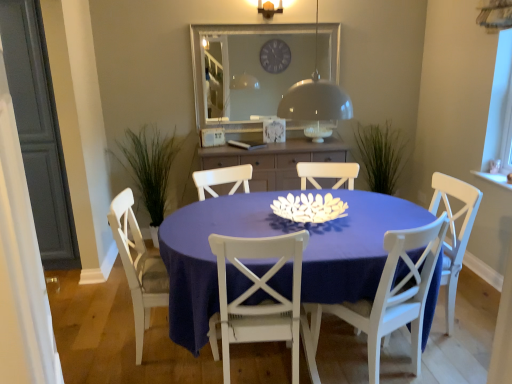
What do you see at coordinates (245, 72) in the screenshot? The image size is (512, 384). I see `clear glass mirror at upper center` at bounding box center [245, 72].

Locate an element on the screen. white wood chair at center, which appears as the 4th chair when viewed from the left is located at coordinates (454, 232).

Describe the element at coordinates (316, 103) in the screenshot. This screenshot has height=384, width=512. I see `white glossy dome at upper center` at that location.

This screenshot has width=512, height=384. What do you see at coordinates (309, 208) in the screenshot?
I see `white matte flower at center` at bounding box center [309, 208].

Describe the element at coordinates (138, 266) in the screenshot. I see `white wood chair at center, the 4th chair viewed from the right` at that location.

Identify the location of white painted wood chair at center, the 3th chair in the right-to-left sequence. (263, 290).

The image size is (512, 384). In order to click on chair behind the white matte flower at center in this screenshot , I will do `click(454, 232)`.

Considering the relative sizes of white matte flower at center and white wood chair at center, which is the first chair in right-to-left order, in the image provided, is white matte flower at center thinner than white wood chair at center, which is the first chair in right-to-left order,?

Correct, the width of white matte flower at center is less than that of white wood chair at center, which is the first chair in right-to-left order.

Consider the image. Is white matte flower at center shorter than white wood chair at center, which appears as the 4th chair when viewed from the left?

Yes, white matte flower at center is shorter than white wood chair at center, which appears as the 4th chair when viewed from the left.

Are green grass at left and white wood chair at center, placed as the 3th chair when sorted from left to right, beside each other?

No.

From a real-world perspective, is green grass at left positioned under white wood chair at center, placed as the 3th chair when sorted from left to right, based on gravity?

No.

In the scene shown: Relative to white wood chair at center, placed as the 3th chair when sorted from left to right, is green grass at left in front or behind?

green grass at left is positioned farther from the viewer than white wood chair at center, placed as the 3th chair when sorted from left to right.

Which is behind, point (129, 164) or point (304, 343)?

The point (129, 164) is more distant.

Can you tell me how much white glossy dome at upper center and white wood chair at center, placed as the 3th chair when sorted from left to right, differ in facing direction?

The facing directions of white glossy dome at upper center and white wood chair at center, placed as the 3th chair when sorted from left to right, are 69 degrees apart.

How much distance is there between white glossy dome at upper center and white wood chair at center, placed as the 3th chair when sorted from left to right?

The distance of white glossy dome at upper center from white wood chair at center, placed as the 3th chair when sorted from left to right, is 89.50 centimeters.

From the image's perspective, count 3rd chairs downward from the white glossy dome at upper center and point to it. Please provide its 2D coordinates.

[(385, 299)]

Could you tell me if white glossy dome at upper center is turned towards white wood chair at center, the 2th chair when ordered from right to left?

No, white glossy dome at upper center is not turned towards white wood chair at center, the 2th chair when ordered from right to left.

Considering the points (233, 162) and (339, 106), which point is in front, point (233, 162) or point (339, 106)?

Point (339, 106)

Which object is more forward, matte wood cabinet at center or white glossy dome at upper center?

white glossy dome at upper center.

Looking at this image, from a real-world perspective, does matte wood cabinet at center stand above white glossy dome at upper center?

No, from a real-world perspective, matte wood cabinet at center is not above white glossy dome at upper center.

Is matte wood cabinet at center wider or thinner than white glossy dome at upper center?

Clearly, matte wood cabinet at center has more width compared to white glossy dome at upper center.

Choose the correct answer: Is white wood chair at center, which is the first chair in right-to-left order, inside matte blue table at center or outside it?

white wood chair at center, which is the first chair in right-to-left order, is spatially positioned inside matte blue table at center.

Is white wood chair at center, which appears as the 4th chair when viewed from the left, taller or shorter than matte blue table at center?

Considering their sizes, white wood chair at center, which appears as the 4th chair when viewed from the left, has more height than matte blue table at center.

Looking at this image, is white wood chair at center, which is the first chair in right-to-left order, aimed at matte blue table at center?

Yes, white wood chair at center, which is the first chair in right-to-left order, is turned towards matte blue table at center.

Considering the positions of objects white wood chair at center, which appears as the 4th chair when viewed from the left, and matte blue table at center in the image provided, who is more to the right, white wood chair at center, which appears as the 4th chair when viewed from the left, or matte blue table at center?

From the viewer's perspective, white wood chair at center, which appears as the 4th chair when viewed from the left, appears more on the right side.

Is white wood chair at center, placed as the 3th chair when sorted from left to right, completely or partially outside of white wood chair at center, the 1th chair when ordered from left to right?

Indeed, white wood chair at center, placed as the 3th chair when sorted from left to right, is completely outside white wood chair at center, the 1th chair when ordered from left to right.

From the image's perspective, is white wood chair at center, placed as the 3th chair when sorted from left to right, above or below white wood chair at center, the 4th chair viewed from the right?

From the image's perspective, white wood chair at center, placed as the 3th chair when sorted from left to right, appears below white wood chair at center, the 4th chair viewed from the right.

Could you measure the distance between white wood chair at center, placed as the 3th chair when sorted from left to right, and white wood chair at center, the 1th chair when ordered from left to right?

white wood chair at center, placed as the 3th chair when sorted from left to right, and white wood chair at center, the 1th chair when ordered from left to right, are 3.67 feet apart from each other.

There is a white wood chair at center, the 2th chair when ordered from right to left. Identify the location of the 1st chair above it (from the image's perspective). The image size is (512, 384). (138, 266).

Looking at their sizes, would you say white wood chair at center, the 2th chair when ordered from right to left, is wider or thinner than matte blue table at center?

Clearly, white wood chair at center, the 2th chair when ordered from right to left, has less width compared to matte blue table at center.

Is the surface of white wood chair at center, placed as the 3th chair when sorted from left to right, in direct contact with matte blue table at center?

There is a gap between white wood chair at center, placed as the 3th chair when sorted from left to right, and matte blue table at center.

How far apart are white wood chair at center, placed as the 3th chair when sorted from left to right, and matte blue table at center?

A: white wood chair at center, placed as the 3th chair when sorted from left to right, and matte blue table at center are 14.10 inches apart.

In the scene shown: Is white wood chair at center, placed as the 3th chair when sorted from left to right, to the left of matte blue table at center from the viewer's perspective?

No, white wood chair at center, placed as the 3th chair when sorted from left to right, is not to the left of matte blue table at center.

There is a white matte flower at center. In order to click on the 1st chair below it (from the image's perspective) in this screenshot , I will do `click(454, 232)`.

At what (x,y) coordinates should I click in order to perform the action: click on plant located above the white wood chair at center, the 2th chair when ordered from right to left (from a real-world perspective). Please return your answer as a coordinate pair (x, y). This screenshot has height=384, width=512. Looking at the image, I should click on (149, 166).

Based on their spatial positions, is white matte flower at center or matte blue table at center further from matte wood cabinet at center?

The object further to matte wood cabinet at center is matte blue table at center.

From the image, which object appears to be nearer to matte blue table at center, white painted wood chair at center, placed as the second chair when sorted from left to right, or matte wood cabinet at center?

Based on the image, white painted wood chair at center, placed as the second chair when sorted from left to right, appears to be nearer to matte blue table at center.

Looking at the image, which one is located closer to white wood chair at center, placed as the 3th chair when sorted from left to right, white matte flower at center or white glossy dome at upper center?

white matte flower at center lies closer to white wood chair at center, placed as the 3th chair when sorted from left to right, than the other object.

When comparing their distances from white wood chair at center, the 1th chair when ordered from left to right, does white painted wood chair at center, the 3th chair in the right-to-left sequence, or green grass at left seem closer?

white painted wood chair at center, the 3th chair in the right-to-left sequence.

Based on their spatial positions, is matte blue table at center or white wood chair at center, placed as the 3th chair when sorted from left to right, closer to clear glass mirror at upper center?

matte blue table at center is positioned closer to the anchor clear glass mirror at upper center.

Based on their spatial positions, is green grass at left or matte wood cabinet at center further from clear glass mirror at upper center?

Based on the image, green grass at left appears to be further to clear glass mirror at upper center.

Based on their spatial positions, is white painted wood chair at center, placed as the second chair when sorted from left to right, or white glossy dome at upper center further from white wood chair at center, the 1th chair when ordered from left to right?

The object further to white wood chair at center, the 1th chair when ordered from left to right, is white glossy dome at upper center.

Looking at the image, which one is located further to white wood chair at center, which is the first chair in right-to-left order, white wood chair at center, the 4th chair viewed from the right, or matte wood cabinet at center?

Based on the image, white wood chair at center, the 4th chair viewed from the right, appears to be further to white wood chair at center, which is the first chair in right-to-left order.

This screenshot has height=384, width=512. Find the location of `flower between white glossy dome at upper center and matte blue table at center vertically`. flower between white glossy dome at upper center and matte blue table at center vertically is located at coordinates (309, 208).

Where is `kitchen & dining room table between white wood chair at center, the 1th chair when ordered from left to right, and white wood chair at center, which appears as the 4th chair when viewed from the left, in the horizontal direction`? The image size is (512, 384). kitchen & dining room table between white wood chair at center, the 1th chair when ordered from left to right, and white wood chair at center, which appears as the 4th chair when viewed from the left, in the horizontal direction is located at coordinates (277, 235).

Where is `lamp between matte blue table at center and green grass at left in the front-back direction`? lamp between matte blue table at center and green grass at left in the front-back direction is located at coordinates (316, 103).

In order to click on lamp between white painted wood chair at center, placed as the second chair when sorted from left to right, and clear glass mirror at upper center in the front-back direction in this screenshot , I will do `click(316, 103)`.